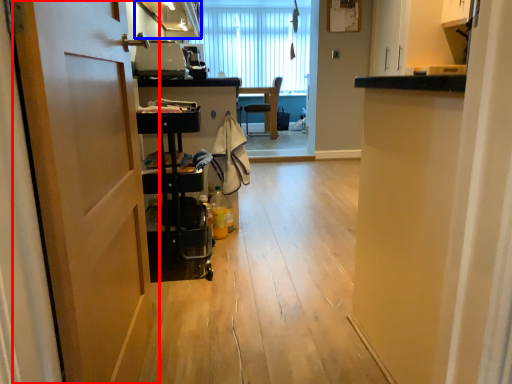
Question: Among these objects, which one is nearest to the camera, door (highlighted by a red box) or cabinetry (highlighted by a blue box)?

Choices:
 (A) door
 (B) cabinetry

Answer: (A)